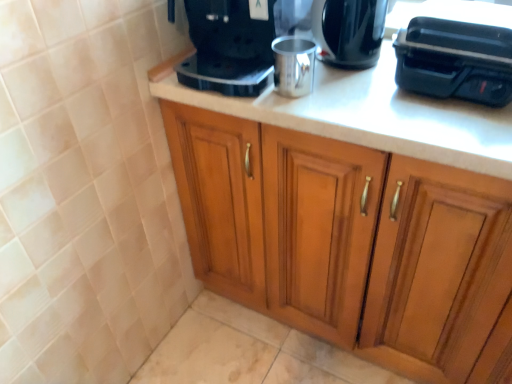
At what (x,y) coordinates should I click in order to perform the action: click on vacant space situated on the left part of black plastic toaster at upper right, the 2th appliance positioned from the left. Please return your answer as a coordinate pair (x, y). Looking at the image, I should click on (364, 103).